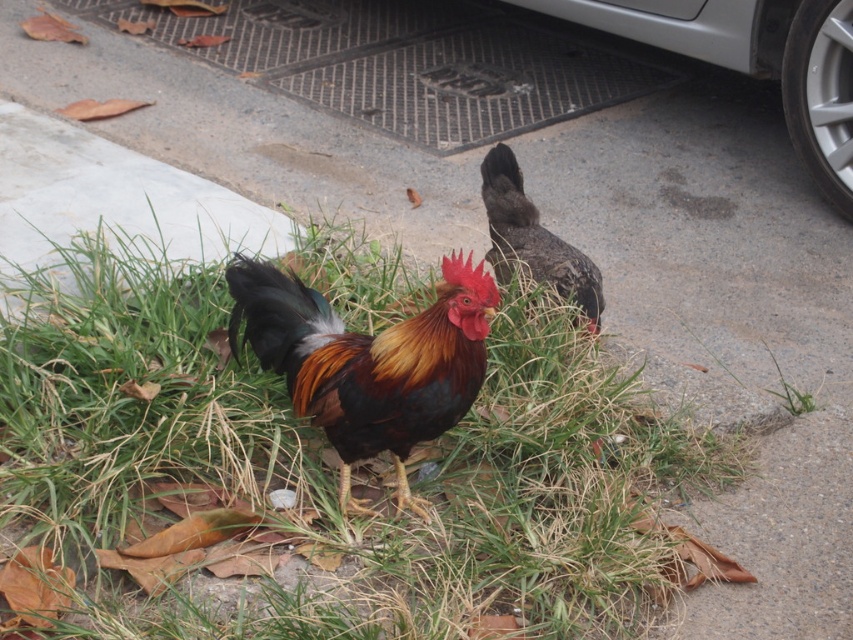
Who is higher up, bright orange and black feathers at center or dark brown feathers at center?

dark brown feathers at center is higher up.

Based on the photo, between bright orange and black feathers at center and dark brown feathers at center, which one has less height?

Standing shorter between the two is dark brown feathers at center.

What do you see at coordinates (368, 362) in the screenshot?
I see `bright orange and black feathers at center` at bounding box center [368, 362].

Locate an element on the screen. bright orange and black feathers at center is located at coordinates (368, 362).

Based on the photo, which of these two, green grass at center or dark brown feathers at center, stands shorter?

dark brown feathers at center is shorter.

Which is behind, point (643, 582) or point (572, 250)?

Positioned behind is point (572, 250).

The height and width of the screenshot is (640, 853). Identify the location of green grass at center. (335, 467).

The image size is (853, 640). Identify the location of green grass at center. (335, 467).

Can you confirm if green grass at center is positioned to the left of bright orange and black feathers at center?

Yes, green grass at center is to the left of bright orange and black feathers at center.

Image resolution: width=853 pixels, height=640 pixels. Find the location of `green grass at center`. green grass at center is located at coordinates [335, 467].

Find the location of a particular element. This screenshot has width=853, height=640. green grass at center is located at coordinates (335, 467).